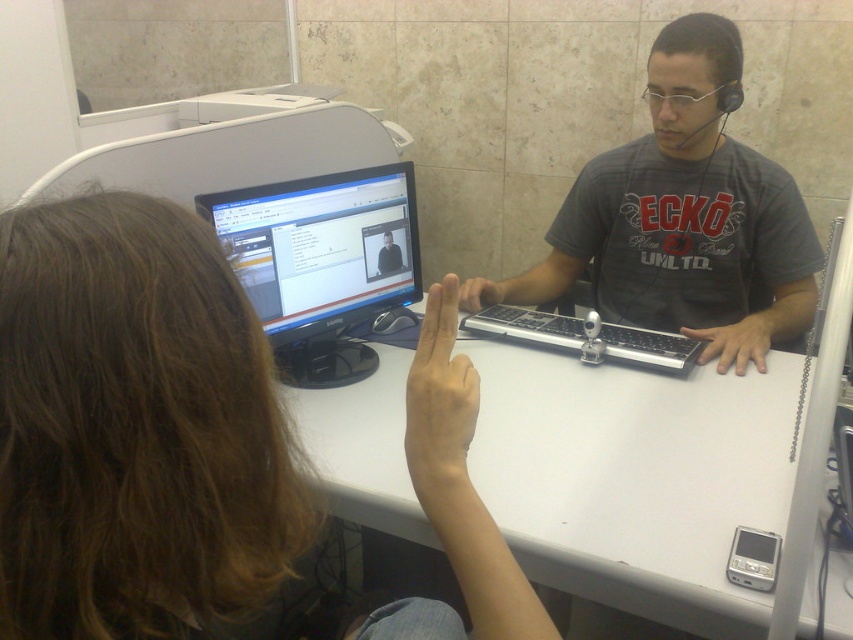
Can you confirm if white plastic table at center is taller than gray matte shirt at center?

No, white plastic table at center is not taller than gray matte shirt at center.

At what (x,y) coordinates should I click in order to perform the action: click on white plastic table at center. Please return your answer as a coordinate pair (x, y). This screenshot has width=853, height=640. Looking at the image, I should click on (636, 480).

Between matte black monitor at upper center and black glossy monitor at center, which one is positioned higher?

black glossy monitor at center

Which of these two, matte black monitor at upper center or black glossy monitor at center, stands shorter?

black glossy monitor at center

Which is in front, point (393, 609) or point (314, 232)?

Point (393, 609) is more forward.

Identify the location of matte black monitor at upper center. (135, 426).

How far apart are gray matte shirt at center and black glossy monitor at center?

A distance of 17.93 inches exists between gray matte shirt at center and black glossy monitor at center.

Between point (799, 240) and point (221, 208), which one is positioned in front?

Positioned in front is point (221, 208).

Identify the location of gray matte shirt at center. (683, 218).